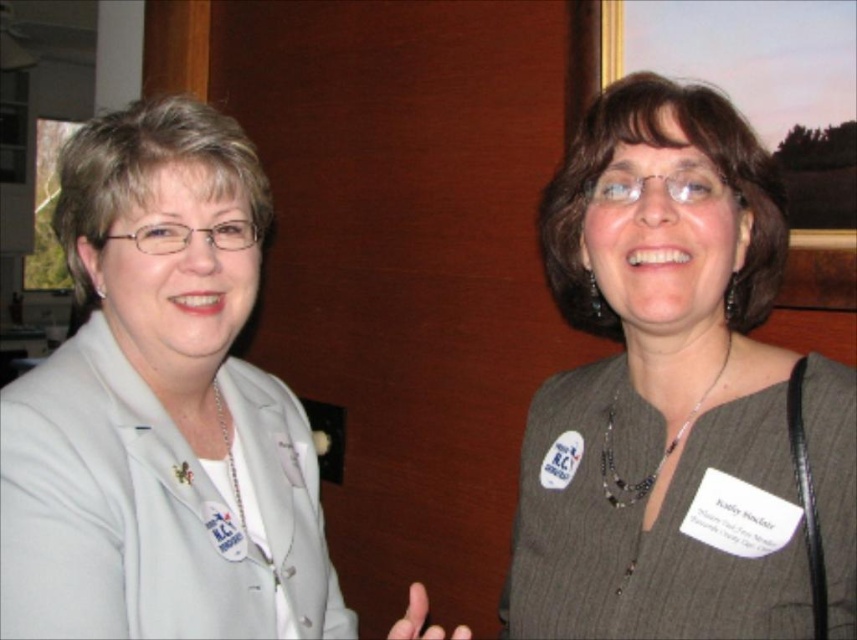
The width and height of the screenshot is (857, 640). What are the coordinates of `gray textured blazer at upper right` in the screenshot? It's located at coord(678,397).

Find the location of a particular element. gray textured blazer at upper right is located at coordinates (678, 397).

Who is positioned more to the right, gray textured blazer at upper right or matte plastic picture frame at upper right?

matte plastic picture frame at upper right

Does gray textured blazer at upper right have a lesser height compared to matte plastic picture frame at upper right?

In fact, gray textured blazer at upper right may be taller than matte plastic picture frame at upper right.

Which is in front, point (688, 104) or point (796, 246)?

Positioned in front is point (688, 104).

Identify the location of gray textured blazer at upper right. (678, 397).

Does point (130, 358) lie behind point (841, 282)?

No.

At what (x,y) coordinates should I click in order to perform the action: click on white fabric at left. Please return your answer as a coordinate pair (x, y). The width and height of the screenshot is (857, 640). Looking at the image, I should click on (160, 410).